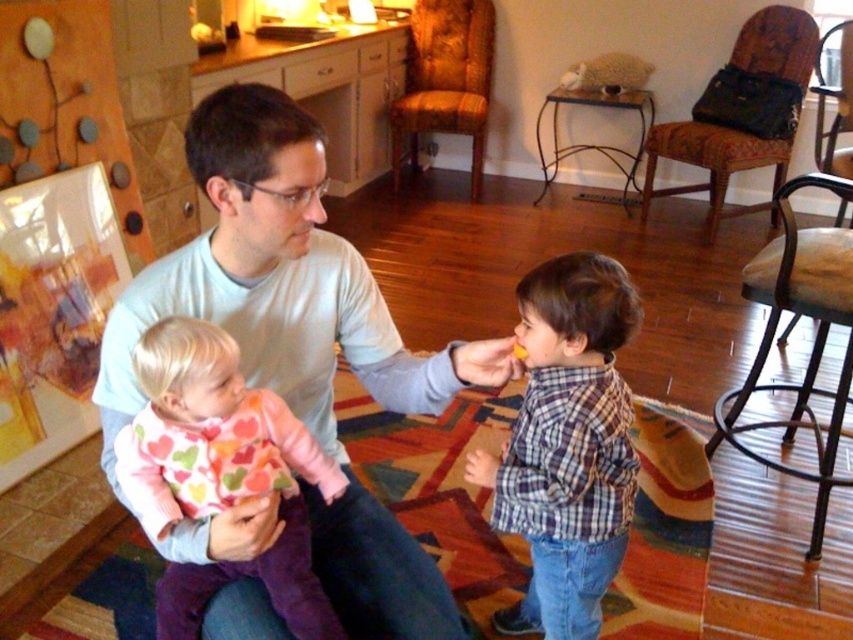
Based on the coordinates provided, what object is located at point [567,444] in the scene?

The point [567,444] corresponds to the plaid cotton shirt at center.